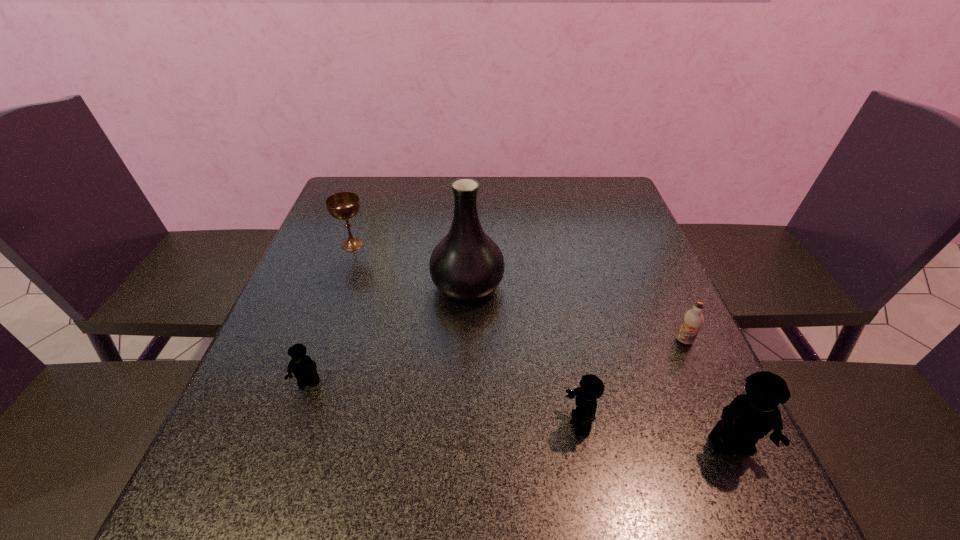
The width and height of the screenshot is (960, 540). In order to click on spot to insert another Lego for uniform distribution in this screenshot , I will do `click(439, 402)`.